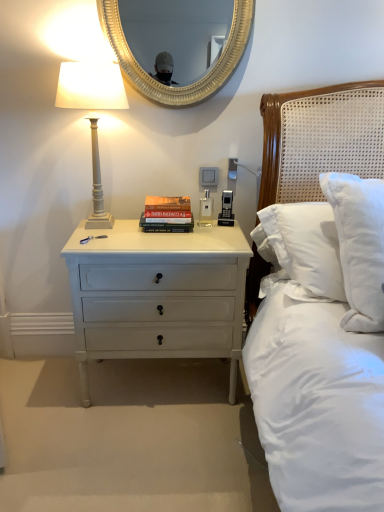
Image resolution: width=384 pixels, height=512 pixels. What are the coordinates of `free space to the right of hardcover book at center` in the screenshot? It's located at (218, 230).